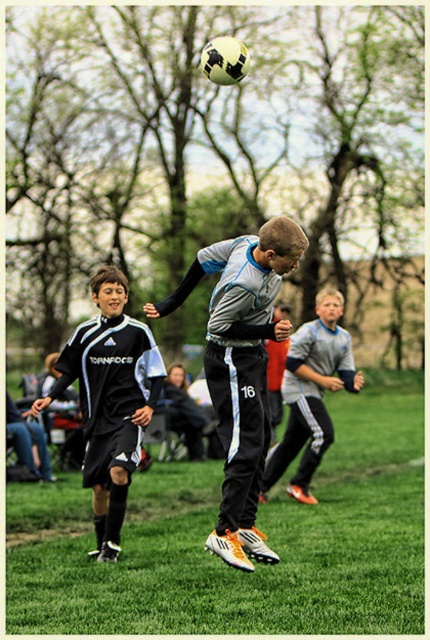
Measure the distance between point (237, 304) and camera.

They are 6.66 meters apart.

Is black matte soccer player at center taller than black adidas soccer uniform at left?

Yes.

Which is behind, point (279, 220) or point (113, 298)?

The point (113, 298) is more distant.

Where is `black matte soccer player at center`? This screenshot has height=640, width=430. black matte soccer player at center is located at coordinates (240, 369).

Which is more to the right, black adidas soccer uniform at left or gray/black athletic pants at center?

From the viewer's perspective, gray/black athletic pants at center appears more on the right side.

Is point (156, 368) positioned before point (298, 483)?

Yes.

Between point (114, 333) and point (328, 292), which one is positioned behind?

Positioned behind is point (328, 292).

At what (x,y) coordinates should I click in order to perform the action: click on black adidas soccer uniform at left. Please return your answer as a coordinate pair (x, y). Looking at the image, I should click on (110, 400).

In the scene shown: Between black matte soccer player at center and gray/black athletic pants at center, which one is positioned lower?

gray/black athletic pants at center

You are a GUI agent. You are given a task and a screenshot of the screen. Output one action in this format:
    pyautogui.click(x=<x>, y=<y>)
    Task: Click on the black matte soccer player at center
    The image size is (430, 640).
    Given the screenshot: What is the action you would take?
    pyautogui.click(x=240, y=369)